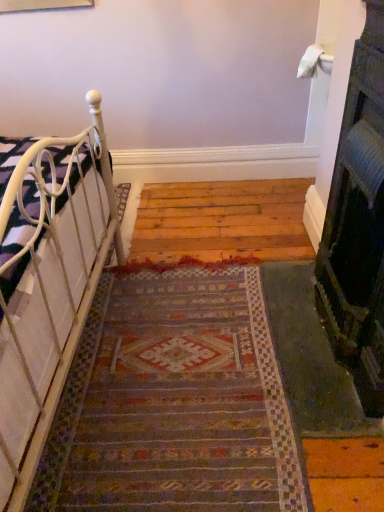
Question: Considering the relative positions of white metal bed at left and black textured fireplace at right in the image provided, is white metal bed at left behind black textured fireplace at right?

Choices:
 (A) no
 (B) yes

Answer: (B)

Question: From a real-world perspective, is white metal bed at left on black textured fireplace at right?

Choices:
 (A) yes
 (B) no

Answer: (B)

Question: Does white metal bed at left have a greater width compared to black textured fireplace at right?

Choices:
 (A) no
 (B) yes

Answer: (B)

Question: From the image's perspective, is white metal bed at left below black textured fireplace at right?

Choices:
 (A) yes
 (B) no

Answer: (A)

Question: Is white metal bed at left located outside black textured fireplace at right?

Choices:
 (A) yes
 (B) no

Answer: (A)

Question: Relative to white metal bed at left, is multicolored woven rug at center in front or behind?

Choices:
 (A) behind
 (B) front

Answer: (A)

Question: Does point (291, 445) appear closer or farther from the camera than point (23, 473)?

Choices:
 (A) farther
 (B) closer

Answer: (A)

Question: From a real-world perspective, relative to white metal bed at left, is multicolored woven rug at center vertically above or below?

Choices:
 (A) below
 (B) above

Answer: (A)

Question: Considering the positions of multicolored woven rug at center and white metal bed at left in the image, is multicolored woven rug at center wider or thinner than white metal bed at left?

Choices:
 (A) thin
 (B) wide

Answer: (B)

Question: Which is correct: white metal bed at left is inside black textured fireplace at right, or outside of it?

Choices:
 (A) inside
 (B) outside

Answer: (B)

Question: In the image, is white metal bed at left positioned in front of or behind black textured fireplace at right?

Choices:
 (A) front
 (B) behind

Answer: (B)

Question: From a real-world perspective, is white metal bed at left above or below black textured fireplace at right?

Choices:
 (A) above
 (B) below

Answer: (B)

Question: Would you say white metal bed at left is to the left or to the right of black textured fireplace at right in the picture?

Choices:
 (A) left
 (B) right

Answer: (A)

Question: Would you say multicolored woven rug at center is to the left or to the right of black textured fireplace at right in the picture?

Choices:
 (A) right
 (B) left

Answer: (B)

Question: From their relative heights in the image, would you say multicolored woven rug at center is taller or shorter than black textured fireplace at right?

Choices:
 (A) short
 (B) tall

Answer: (A)